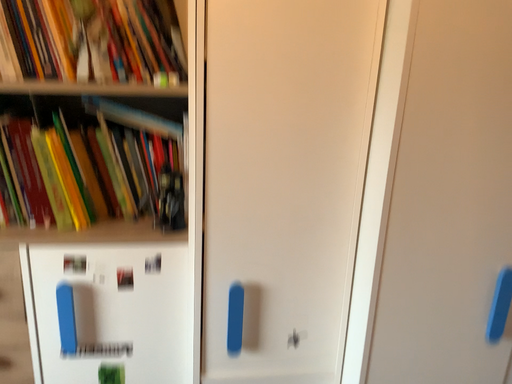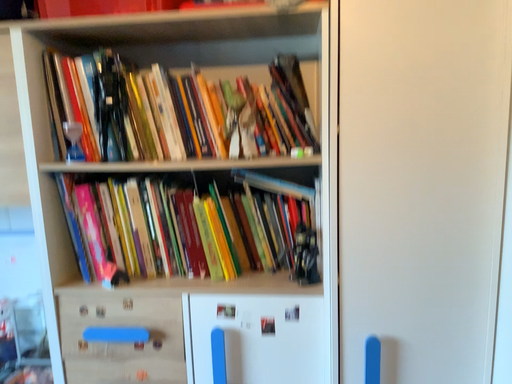
Question: Which way did the camera rotate in the video?

Choices:
 (A) rotated left
 (B) rotated right

Answer: (A)